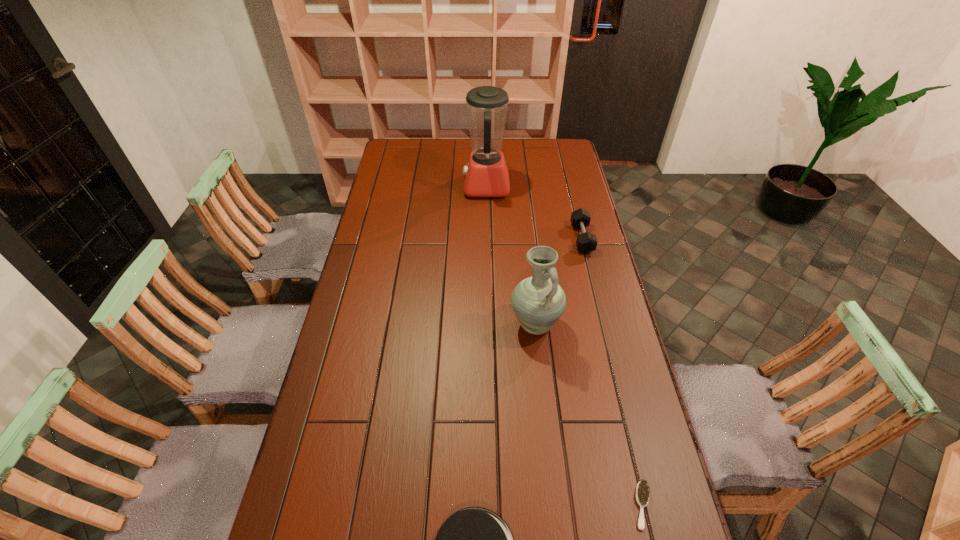
Identify the location of free space that satisfies the following two spatial constraints: 1. on the handle side of the shortest object; 2. on the left side of the pitcher. (555, 505).

This screenshot has height=540, width=960. In order to click on free location that satisfies the following two spatial constraints: 1. on the handle side of the third farthest object; 2. on the right side of the scrubbing brush in this screenshot , I will do `click(555, 505)`.

Locate an element on the screen. free space that satisfies the following two spatial constraints: 1. on the handle side of the third farthest object; 2. on the left side of the shortest object is located at coordinates (555, 505).